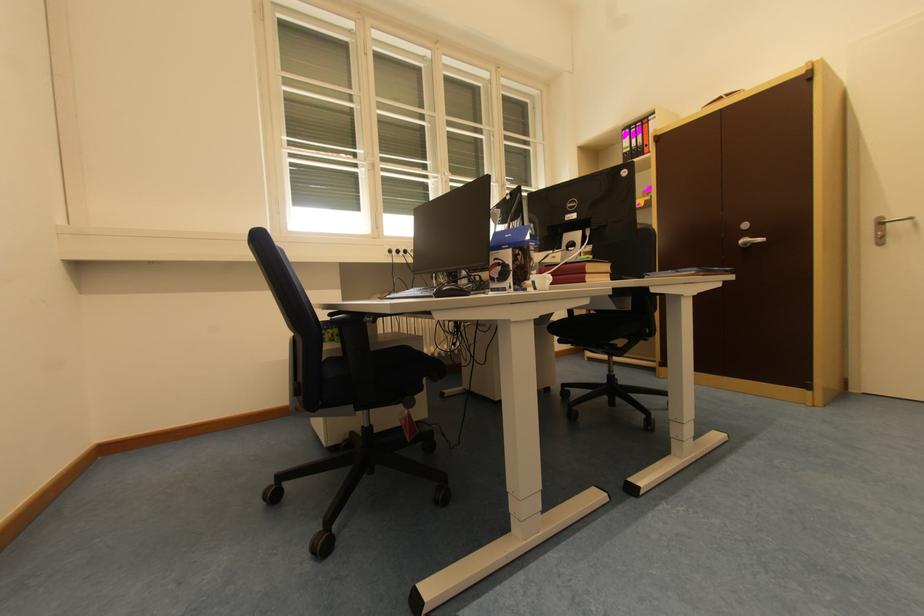
What do you see at coordinates (602, 328) in the screenshot? The height and width of the screenshot is (616, 924). I see `the black chair sitting surface` at bounding box center [602, 328].